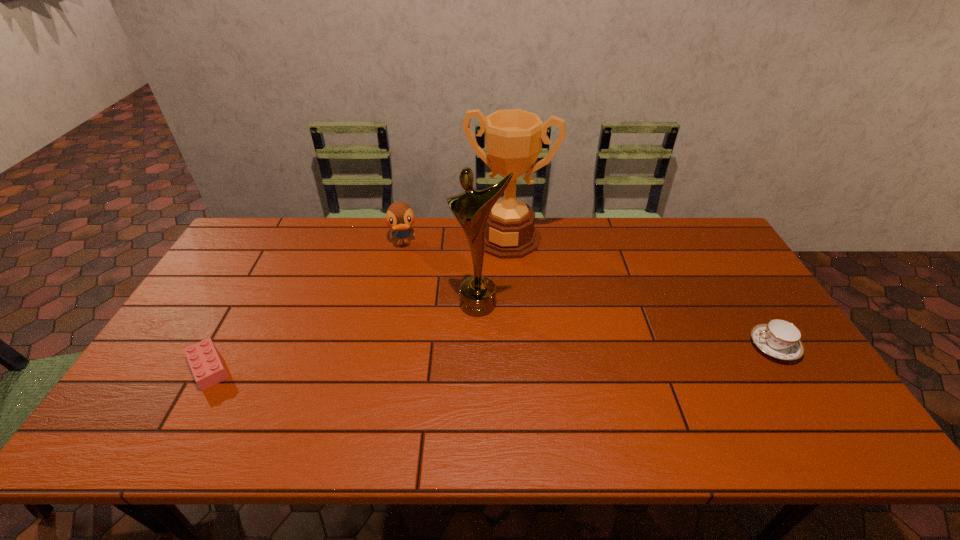
Find the location of a particular element. The width and height of the screenshot is (960, 540). free space located 0.140m on the front-facing side of the nearer award is located at coordinates (451, 354).

The image size is (960, 540). I want to click on award that is at the far edge, so click(513, 137).

Find the location of `duck that is at the far edge`. duck that is at the far edge is located at coordinates (399, 216).

Where is `object at the near edge`? The width and height of the screenshot is (960, 540). object at the near edge is located at coordinates (206, 365).

Locate an element on the screen. object situated at the left edge is located at coordinates (206, 365).

Find the location of a particular element. object that is at the right edge is located at coordinates (780, 339).

The height and width of the screenshot is (540, 960). What are the coordinates of `object at the near left corner` in the screenshot? It's located at (206, 365).

This screenshot has width=960, height=540. Find the location of `free spot at the far edge of the desktop`. free spot at the far edge of the desktop is located at coordinates (369, 223).

At what (x,y) coordinates should I click in order to perform the action: click on vacant space at the near edge. Please return your answer as a coordinate pair (x, y). Looking at the image, I should click on (509, 381).

Where is `free region at the left edge of the desktop`? The image size is (960, 540). free region at the left edge of the desktop is located at coordinates (191, 332).